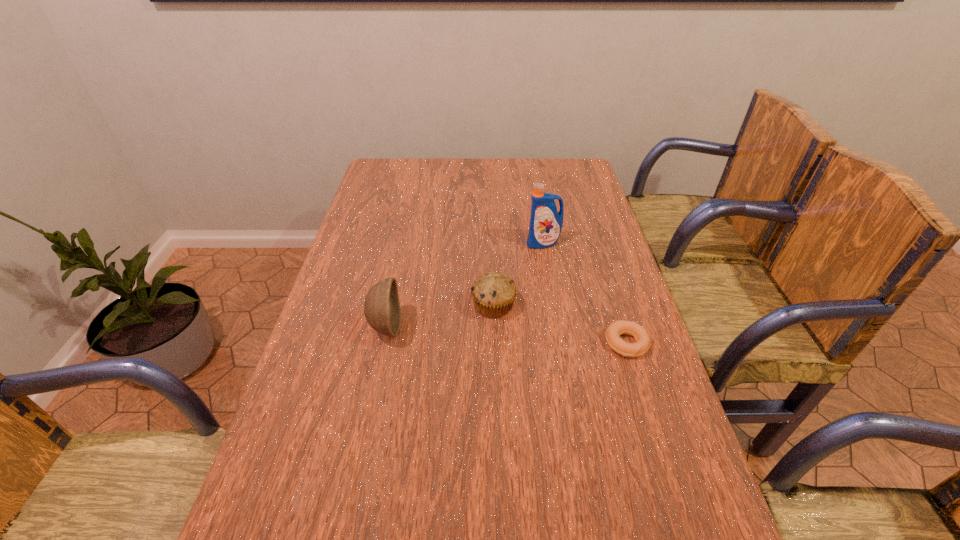
Where is `free space located on the right of the second shortest object`? This screenshot has width=960, height=540. free space located on the right of the second shortest object is located at coordinates (545, 305).

Locate an element on the screen. free space located 0.190m on the left of the shortest object is located at coordinates (528, 343).

Find the location of a particular element. The height and width of the screenshot is (540, 960). object situated at the left edge is located at coordinates (382, 310).

In order to click on object present at the right edge in this screenshot , I will do `click(643, 341)`.

In order to click on vacant area at the far edge in this screenshot , I will do `click(516, 165)`.

You are a GUI agent. You are given a task and a screenshot of the screen. Output one action in this format:
    pyautogui.click(x=<x>, y=<y>)
    Task: Click on the free region at the left edge of the desktop
    This screenshot has height=540, width=960.
    Given the screenshot: What is the action you would take?
    tap(344, 313)

In the image, there is a desktop. Where is `vacant area at the right edge`? The height and width of the screenshot is (540, 960). vacant area at the right edge is located at coordinates (609, 234).

This screenshot has height=540, width=960. I want to click on empty location between the leftmost object and the rightmost object, so click(506, 335).

I want to click on empty location between the third tallest object and the farthest object, so click(x=518, y=274).

At what (x,y) coordinates should I click in order to perform the action: click on vacant area between the third shortest object and the detergent. Please return your answer as a coordinate pair (x, y). This screenshot has width=960, height=540. Looking at the image, I should click on (465, 285).